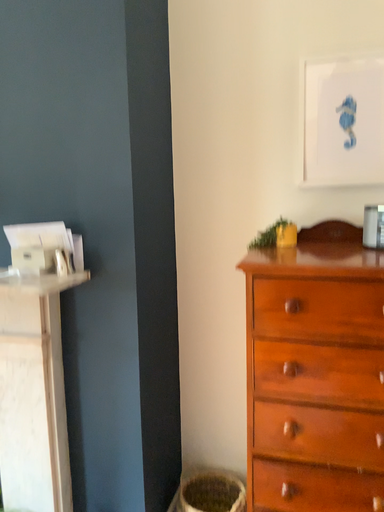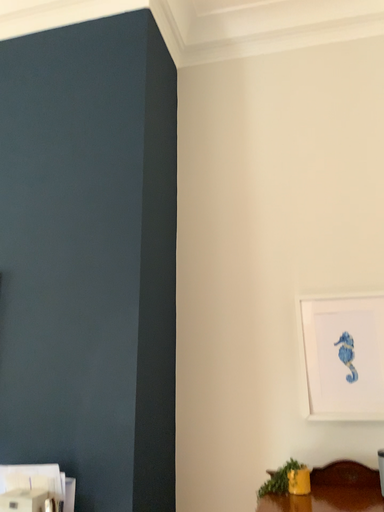
Question: How did the camera likely rotate when shooting the video?

Choices:
 (A) rotated upward
 (B) rotated downward

Answer: (A)